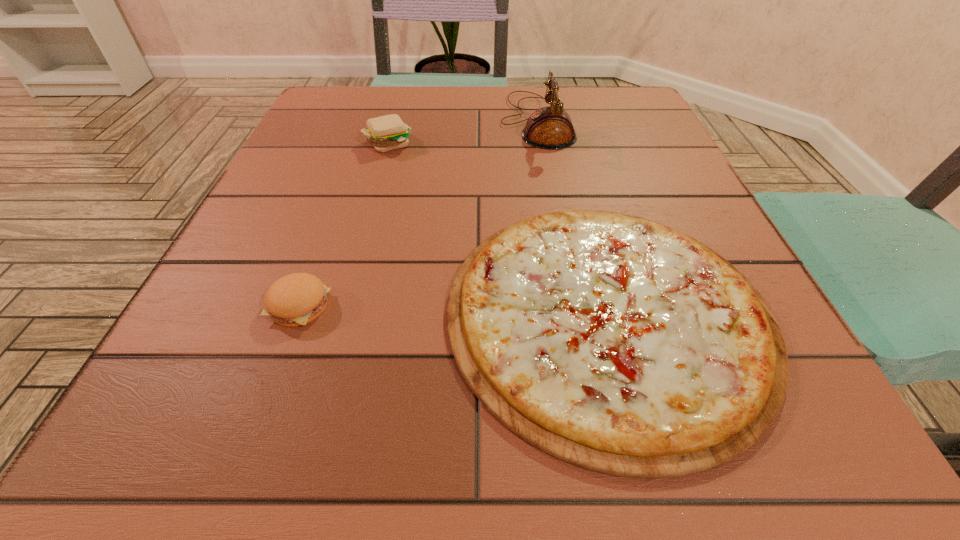
This screenshot has width=960, height=540. I want to click on vacant space located on the back of the shorter patty, so click(352, 165).

Where is `blank space located on the back of the pizza`? blank space located on the back of the pizza is located at coordinates (571, 174).

You are a GUI agent. You are given a task and a screenshot of the screen. Output one action in this format:
    pyautogui.click(x=<x>, y=<y>)
    Task: Click on the telephone positioned at the far edge
    This screenshot has height=540, width=960.
    Given the screenshot: What is the action you would take?
    pyautogui.click(x=550, y=127)

Locate an element on the screen. Image resolution: width=960 pixels, height=540 pixels. patty situated at the far edge is located at coordinates (385, 133).

Locate an element on the screen. The image size is (960, 540). object present at the near edge is located at coordinates (617, 344).

Where is `object that is at the right edge`? This screenshot has height=540, width=960. object that is at the right edge is located at coordinates (617, 344).

Where is `object positioned at the far left corner`? object positioned at the far left corner is located at coordinates click(385, 133).

The height and width of the screenshot is (540, 960). What are the coordinates of `object that is at the near right corner` in the screenshot? It's located at (617, 344).

Identify the location of vacant area at the far edge of the desktop. The width and height of the screenshot is (960, 540). (416, 97).

In the image, there is a desktop. Where is `blank space at the near edge`? blank space at the near edge is located at coordinates (397, 431).